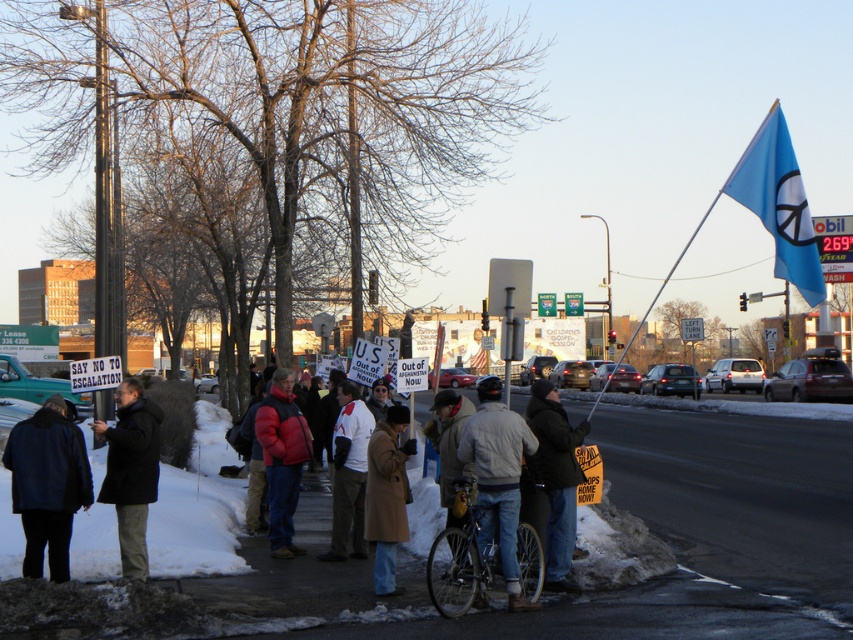
You are a photographer trying to capture a clear shot of the red puffy jacket at center and the snowy asphalt sidewalk at lower left. Which object is closer to the camera, and why?

The red puffy jacket at center is closer to the camera because the snowy asphalt sidewalk at lower left is shorter than it, indicating it is further away.

You are a delivery person needing to quickly reach the metallic silver bicycle at center. You are currently standing on the snowy asphalt sidewalk at lower left. Can you walk directly to the bicycle without stepping off the sidewalk?

The snowy asphalt sidewalk at lower left is in front of metallic silver bicycle at center, meaning the sidewalk is between you and the bicycle. To reach the bicycle, you would need to step off the sidewalk and onto the road or another path, so you cannot walk directly to the metallic silver bicycle at center without leaving the sidewalk.

You are a photographer trying to capture the protest scene. You notice two points in the image at coordinates point (479, 468) and point (396, 436). If you want to focus on the one that is closer to your camera, which coordinate should you aim for?

You should aim for point (479, 468) because it is closer to the camera than point (396, 436).